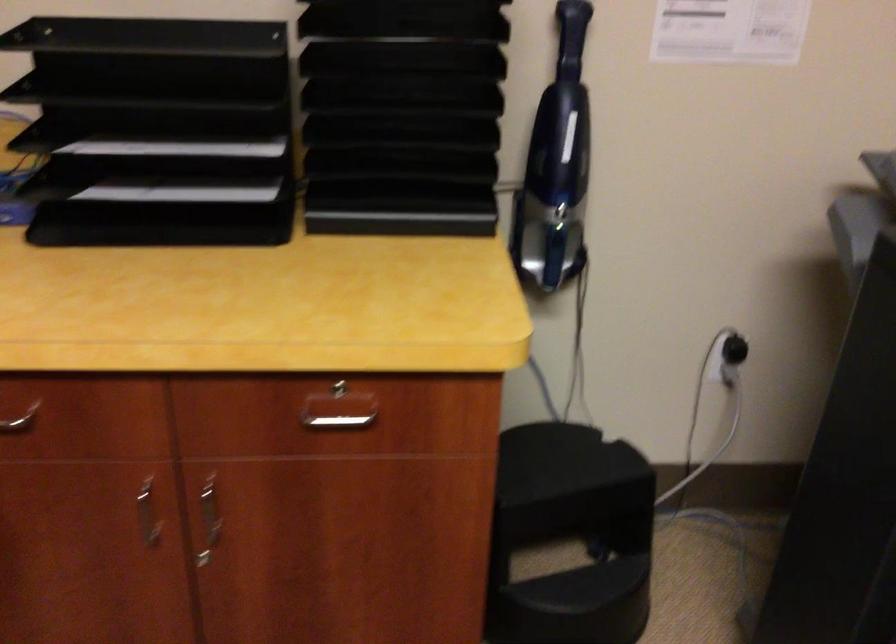
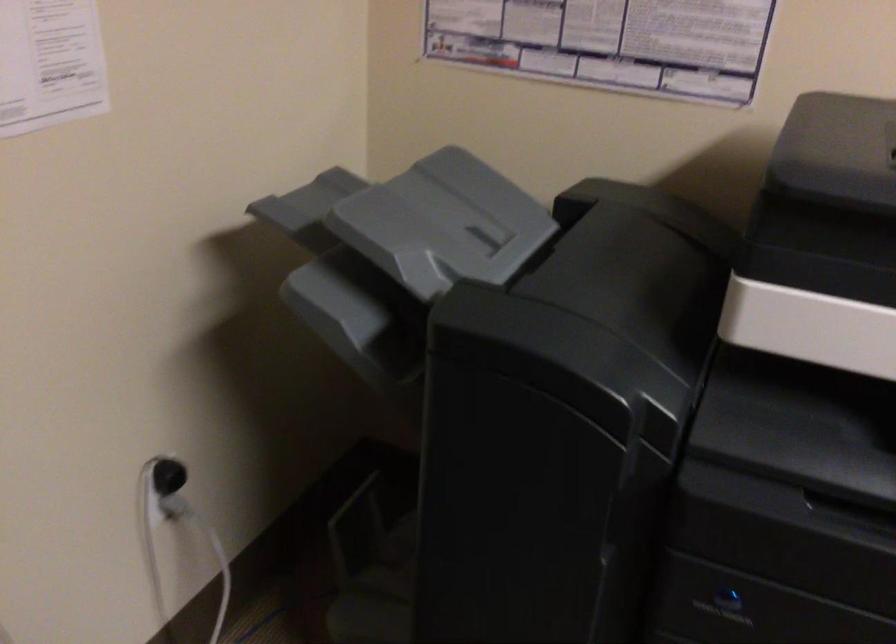
Locate, in the second image, the point that corresponds to [736,351] in the first image.

(168, 476)